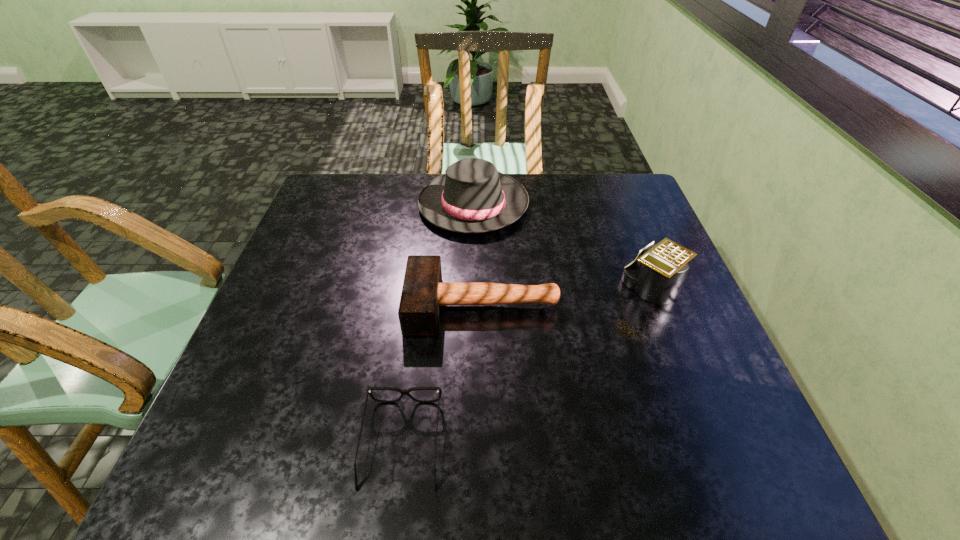
The width and height of the screenshot is (960, 540). In order to click on free space between the rightmost object and the farthest object in this screenshot , I will do `click(564, 247)`.

Find the location of a particular element. This screenshot has height=540, width=960. free space between the farthest object and the rightmost object is located at coordinates (564, 247).

I want to click on free space between the mallet and the calculator, so click(568, 297).

Where is `empty space that is in between the rightmost object and the third tallest object`? The height and width of the screenshot is (540, 960). empty space that is in between the rightmost object and the third tallest object is located at coordinates (568, 297).

This screenshot has width=960, height=540. In order to click on vacant point located between the spectacles and the calculator in this screenshot , I will do `click(528, 366)`.

Where is `free space that is in between the nearest object and the mallet`? Image resolution: width=960 pixels, height=540 pixels. free space that is in between the nearest object and the mallet is located at coordinates (443, 374).

This screenshot has width=960, height=540. In order to click on vacant area between the mallet and the dress hat in this screenshot , I will do `click(478, 255)`.

The height and width of the screenshot is (540, 960). I want to click on free point between the farthest object and the calculator, so click(x=564, y=247).

Locate which object is the second closest to the second shortest object. Please provide its 2D coordinates. Your answer should be formatted as a tuple, i.e. [(x, y)], where the tuple contains the x and y coordinates of a point satisfying the conditions above.

[(403, 392)]

Identify which object is the second closest to the rightmost object. Please provide its 2D coordinates. Your answer should be formatted as a tuple, i.e. [(x, y)], where the tuple contains the x and y coordinates of a point satisfying the conditions above.

[(472, 197)]